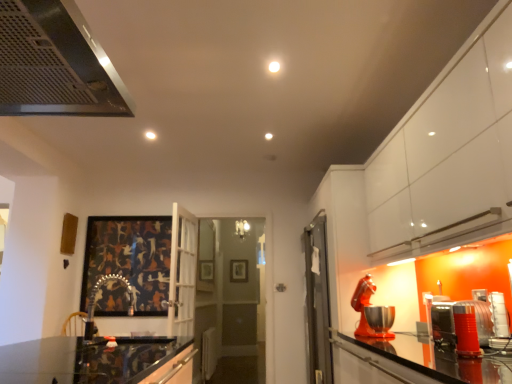
Question: Does metallic silver toaster at lower right, acting as the third appliance starting from the back, turn towards wooden picture frame at center, the first picture frame when ordered from back to front?

Choices:
 (A) no
 (B) yes

Answer: (A)

Question: Is metallic silver toaster at lower right, acting as the third appliance starting from the back, next to wooden picture frame at center, which is the first picture frame from right to left, and touching it?

Choices:
 (A) no
 (B) yes

Answer: (A)

Question: Is metallic silver toaster at lower right, acting as the third appliance starting from the back, looking in the opposite direction of wooden picture frame at center, which ranks as the 2th picture frame in top-to-bottom order?

Choices:
 (A) no
 (B) yes

Answer: (A)

Question: Considering the relative sizes of metallic silver toaster at lower right, the second appliance positioned from the front, and wooden picture frame at center, the first picture frame when ordered from back to front, in the image provided, is metallic silver toaster at lower right, the second appliance positioned from the front, bigger than wooden picture frame at center, the first picture frame when ordered from back to front,?

Choices:
 (A) yes
 (B) no

Answer: (A)

Question: Is metallic silver toaster at lower right, the second appliance positioned from the front, behind wooden picture frame at center, which appears as the 2th picture frame when viewed from the left?

Choices:
 (A) no
 (B) yes

Answer: (A)

Question: Does metallic silver toaster at lower right, the second appliance positioned from the front, have a lesser width compared to wooden picture frame at center, placed as the 1th picture frame when sorted from bottom to top?

Choices:
 (A) no
 (B) yes

Answer: (A)

Question: Is metallic silver toaster at lower right, the second appliance positioned from the front, inside dark matte painting at center, the first picture frame when ordered from top to bottom?

Choices:
 (A) no
 (B) yes

Answer: (A)

Question: From a real-world perspective, is dark matte painting at center, positioned as the first picture frame in front-to-back order, on top of metallic silver toaster at lower right, acting as the third appliance starting from the back?

Choices:
 (A) yes
 (B) no

Answer: (A)

Question: Is dark matte painting at center, positioned as the first picture frame in front-to-back order, located outside metallic silver toaster at lower right, the second appliance positioned from the front?

Choices:
 (A) no
 (B) yes

Answer: (B)

Question: Does dark matte painting at center, the first picture frame when ordered from top to bottom, come in front of metallic silver toaster at lower right, acting as the third appliance starting from the back?

Choices:
 (A) no
 (B) yes

Answer: (A)

Question: Is dark matte painting at center, the second picture frame from the back, thinner than metallic silver toaster at lower right, acting as the third appliance starting from the back?

Choices:
 (A) no
 (B) yes

Answer: (B)

Question: Considering the relative positions of dark matte painting at center, which appears as the 2th picture frame when ordered from the bottom, and metallic silver toaster at lower right, the second appliance positioned from the front, in the image provided, is dark matte painting at center, which appears as the 2th picture frame when ordered from the bottom, to the left of metallic silver toaster at lower right, the second appliance positioned from the front, from the viewer's perspective?

Choices:
 (A) no
 (B) yes

Answer: (B)

Question: Is dark matte painting at center, which appears as the 2th picture frame when ordered from the bottom, directly adjacent to rubberized orange blender at right, placed as the fourth appliance when sorted from back to front?

Choices:
 (A) no
 (B) yes

Answer: (A)